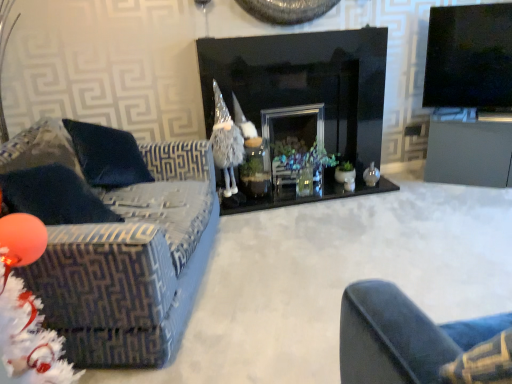
What do you see at coordinates (303, 103) in the screenshot? I see `black glass fireplace at center` at bounding box center [303, 103].

Where is `translucent glass vase at center`? The height and width of the screenshot is (384, 512). translucent glass vase at center is located at coordinates (298, 164).

Image resolution: width=512 pixels, height=384 pixels. What do you see at coordinates (469, 57) in the screenshot?
I see `black glossy tv at upper right` at bounding box center [469, 57].

Find the location of a particular element. This screenshot has height=384, width=512. velvet-patterned couch at left is located at coordinates (133, 263).

Is black glossy tv at upper right positioned with its back to translucent glass vase at center?

No, translucent glass vase at center is not at the back of black glossy tv at upper right.

Is black glossy tv at upper right inside or outside of translucent glass vase at center?

The correct answer is: outside.

Between black glossy tv at upper right and translucent glass vase at center, which one appears on the right side from the viewer's perspective?

From the viewer's perspective, black glossy tv at upper right appears more on the right side.

From a real-world perspective, does black glossy tv at upper right stand above translucent glass vase at center?

Correct, in the physical world, black glossy tv at upper right is higher than translucent glass vase at center.

Can you tell me how much matte gray table at right and black glass fireplace at center differ in facing direction?

33.3 degrees separate the facing orientations of matte gray table at right and black glass fireplace at center.

From a real-world perspective, does matte gray table at right sit lower than black glass fireplace at center?

Yes, from a real-world perspective, matte gray table at right is under black glass fireplace at center.

Identify the location of table to the right of black glass fireplace at center. (469, 153).

Is matte gray table at right touching black glass fireplace at center?

They are not placed beside each other.

Consider the image. Visually, is matte gray table at right positioned to the left or to the right of black glossy tv at upper right?

Based on their positions, matte gray table at right is located to the right of black glossy tv at upper right.

From a real-world perspective, who is located lower, matte gray table at right or black glossy tv at upper right?

From a 3D spatial view, matte gray table at right is below.

Are matte gray table at right and black glossy tv at upper right making contact?

No, matte gray table at right is not with black glossy tv at upper right.

Is matte gray table at right smaller than black glossy tv at upper right?

No.

Between translucent glass vase at center and velvet-patterned couch at left, which one has larger width?

velvet-patterned couch at left is wider.

Considering the relative sizes of translucent glass vase at center and velvet-patterned couch at left in the image provided, is translucent glass vase at center smaller than velvet-patterned couch at left?

Indeed, translucent glass vase at center has a smaller size compared to velvet-patterned couch at left.

Can you tell me how much translucent glass vase at center and velvet-patterned couch at left differ in facing direction?

The facing directions of translucent glass vase at center and velvet-patterned couch at left are 76 degrees apart.

Which is in front, point (278, 159) or point (82, 233)?

The point (82, 233) is closer.

Could you tell me if black glossy tv at upper right is facing matte gray table at right?

No.

Would you say black glossy tv at upper right is a long distance from matte gray table at right?

No, black glossy tv at upper right is not far away from matte gray table at right.

Considering the relative sizes of black glossy tv at upper right and matte gray table at right in the image provided, is black glossy tv at upper right wider than matte gray table at right?

No, black glossy tv at upper right is not wider than matte gray table at right.

Is the depth of black glossy tv at upper right less than that of matte gray table at right?

Yes.

Is velvet-patterned couch at left to the left of translucent glass vase at center from the viewer's perspective?

Correct, you'll find velvet-patterned couch at left to the left of translucent glass vase at center.

From the image's perspective, is velvet-patterned couch at left positioned above or below translucent glass vase at center?

Based on their image positions, velvet-patterned couch at left is located beneath translucent glass vase at center.

The height and width of the screenshot is (384, 512). I want to click on studio couch on the left of translucent glass vase at center, so click(x=133, y=263).

How different are the orientations of velvet-patterned couch at left and translucent glass vase at center in degrees?

The angle between the facing direction of velvet-patterned couch at left and the facing direction of translucent glass vase at center is 76 degrees.

From a real-world perspective, who is located lower, black glass fireplace at center or black glossy tv at upper right?

black glass fireplace at center is physically lower.

Considering the sizes of objects black glass fireplace at center and black glossy tv at upper right in the image provided, who is thinner, black glass fireplace at center or black glossy tv at upper right?

With smaller width is black glossy tv at upper right.

Where is `television behind the black glass fireplace at center`? This screenshot has width=512, height=384. television behind the black glass fireplace at center is located at coordinates (469, 57).

Would you say black glass fireplace at center is outside black glossy tv at upper right?

Yes, black glass fireplace at center is located beyond the bounds of black glossy tv at upper right.

Find the location of a particular element. television above the translucent glass vase at center (from a real-world perspective) is located at coordinates (469, 57).

Where is `table lying on the right of black glass fireplace at center`? Image resolution: width=512 pixels, height=384 pixels. table lying on the right of black glass fireplace at center is located at coordinates (469, 153).

Considering their positions, is black glass fireplace at center positioned further to black glossy tv at upper right than matte gray table at right?

black glass fireplace at center lies further to black glossy tv at upper right than the other object.

From the image, which object appears to be nearer to velvet-patterned couch at left, translucent glass vase at center or black glossy tv at upper right?

translucent glass vase at center.

When comparing their distances from matte gray table at right, does black glossy tv at upper right or velvet-patterned couch at left seem further?

velvet-patterned couch at left.

Looking at the image, which one is located closer to velvet-patterned couch at left, matte gray table at right or black glossy tv at upper right?

matte gray table at right lies closer to velvet-patterned couch at left than the other object.

Considering their positions, is black glossy tv at upper right positioned closer to black glass fireplace at center than translucent glass vase at center?

translucent glass vase at center lies closer to black glass fireplace at center than the other object.

When comparing their distances from black glossy tv at upper right, does translucent glass vase at center or black glass fireplace at center seem further?

Based on the image, translucent glass vase at center appears to be further to black glossy tv at upper right.

Looking at the image, which one is located further to velvet-patterned couch at left, black glass fireplace at center or matte gray table at right?

matte gray table at right is positioned further to the anchor velvet-patterned couch at left.

Based on their spatial positions, is black glossy tv at upper right or black glass fireplace at center further from matte gray table at right?

The object further to matte gray table at right is black glass fireplace at center.

Find the location of a particular element. The width and height of the screenshot is (512, 384). fireplace between velvet-patterned couch at left and translucent glass vase at center in the front-back direction is located at coordinates (303, 103).

Identify the location of fireplace between velvet-patterned couch at left and matte gray table at right in the horizontal direction. The width and height of the screenshot is (512, 384). (303, 103).

Find the location of a particular element. christmas decoration between velvet-patterned couch at left and matte gray table at right is located at coordinates point(298,164).

Find the location of a particular element. christmas decoration between black glass fireplace at center and matte gray table at right from left to right is located at coordinates (298, 164).